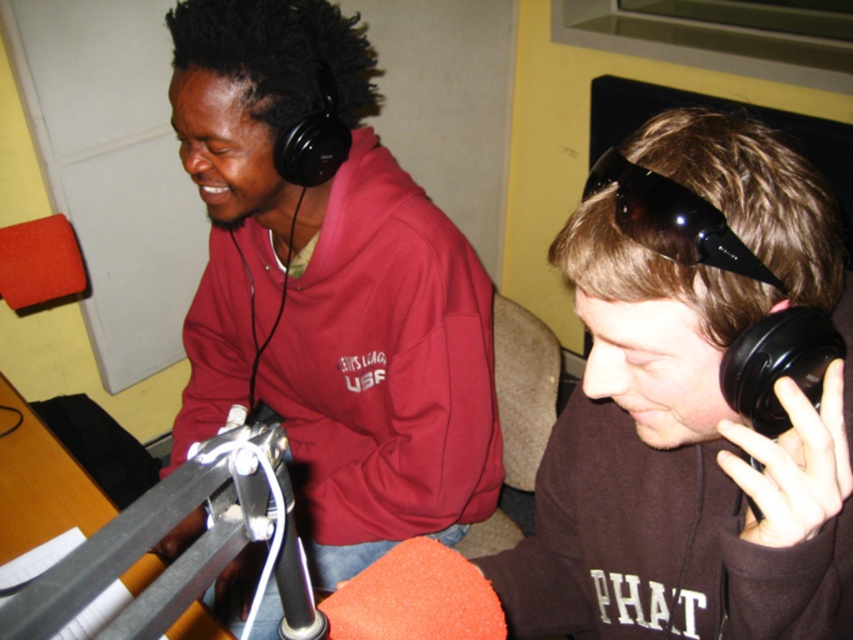
Does brown matte hoodie at center have a greater width compared to black matte microphone at right?

Yes, brown matte hoodie at center is wider than black matte microphone at right.

Which is below, brown matte hoodie at center or black matte microphone at right?

Positioned lower is brown matte hoodie at center.

Where is `brown matte hoodie at center`? This screenshot has width=853, height=640. brown matte hoodie at center is located at coordinates [691, 410].

Does brown matte hoodie at center have a lesser height compared to black shiny goggles at upper right?

No.

Can you confirm if brown matte hoodie at center is wider than black shiny goggles at upper right?

Indeed, brown matte hoodie at center has a greater width compared to black shiny goggles at upper right.

Identify the location of brown matte hoodie at center. (691, 410).

Does black shiny goggles at upper right have a lesser height compared to black matte microphone at right?

No.

Where is `black shiny goggles at upper right`? black shiny goggles at upper right is located at coordinates (672, 220).